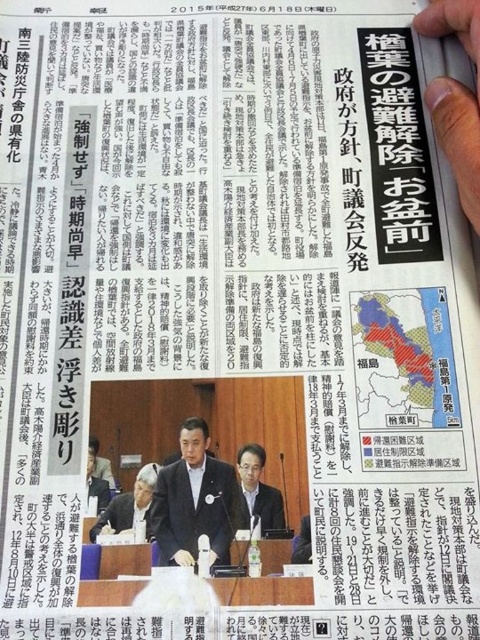
Question: Based on their relative distances, which object is nearer to the matte black suit at center?

Choices:
 (A) dark blue suit at center
 (B) white fabric jacket at center

Answer: (A)

Question: Considering the relative positions of dark blue suit at center and matte black suit at center in the image provided, where is dark blue suit at center located with respect to matte black suit at center?

Choices:
 (A) below
 (B) above

Answer: (A)

Question: Does dark blue suit at center appear under matte black suit at center?

Choices:
 (A) yes
 (B) no

Answer: (A)

Question: Considering the real-world distances, which object is closest to the white fabric jacket at center?

Choices:
 (A) dark blue suit at center
 (B) matte black suit at center

Answer: (A)

Question: Which point is farther from the camera taking this photo?

Choices:
 (A) (141, 467)
 (B) (184, 554)

Answer: (A)

Question: Does matte black suit at center lie in front of white fabric jacket at center?

Choices:
 (A) yes
 (B) no

Answer: (A)